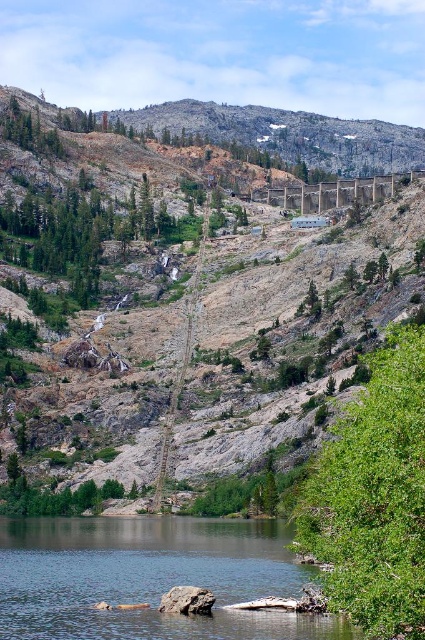
Who is positioned more to the left, green leafy tree at right or concrete bridge at center?

From the viewer's perspective, green leafy tree at right appears more on the left side.

Between point (399, 349) and point (348, 204), which one is positioned in front?

Point (399, 349) is more forward.

You are a GUI agent. You are given a task and a screenshot of the screen. Output one action in this format:
    pyautogui.click(x=<x>, y=<y>)
    Task: Click on the green leafy tree at right
    
    Given the screenshot: What is the action you would take?
    (x=374, y=497)

Can you confirm if green leafy tree at right is bigger than gray rock at lower center?

Yes.

Does green leafy tree at right appear on the right side of gray rock at lower center?

Correct, you'll find green leafy tree at right to the right of gray rock at lower center.

Which is in front, point (411, 449) or point (161, 608)?

Point (411, 449) is in front.

The width and height of the screenshot is (425, 640). What are the coordinates of `green leafy tree at right` in the screenshot? It's located at (374, 497).

Who is higher up, green leafy tree at upper left or gray rock at lower center?

green leafy tree at upper left

Is green leafy tree at upper left above gray rock at lower center?

Indeed, green leafy tree at upper left is positioned over gray rock at lower center.

Locate an element on the screen. The image size is (425, 640). green leafy tree at upper left is located at coordinates (28, 131).